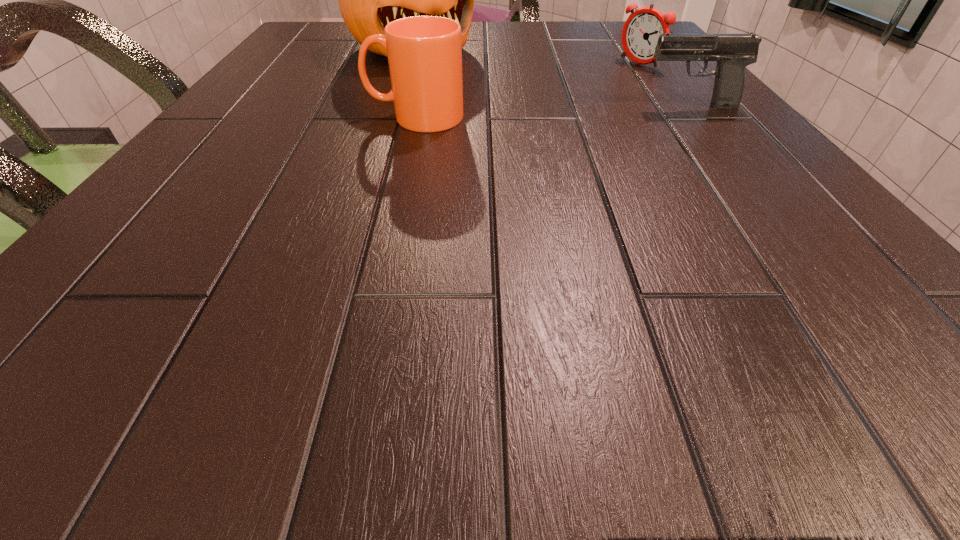
At what (x,y) coordinates should I click in order to perform the action: click on free space located on the face of the pumpkin. Please return your answer as a coordinate pair (x, y). Image resolution: width=960 pixels, height=540 pixels. Looking at the image, I should click on (472, 85).

Identify the location of vacant space situated 0.050m on the face of the pumpkin. The image size is (960, 540). (455, 73).

Locate an element on the screen. free location located 0.380m on the face of the pumpkin is located at coordinates (559, 139).

I want to click on blank space located on the front-facing side of the alarm clock, so click(540, 110).

Locate an element on the screen. vacant space situated 0.310m on the front-facing side of the alarm clock is located at coordinates (528, 115).

At what (x,y) coordinates should I click in order to perform the action: click on free space located 0.100m on the front-facing side of the alarm clock. Please return your answer as a coordinate pair (x, y). Looking at the image, I should click on (599, 82).

This screenshot has width=960, height=540. I want to click on object present at the far edge, so click(x=368, y=0).

The width and height of the screenshot is (960, 540). Identify the location of object at the left edge. (368, 0).

Where is `pistol present at the right edge`? Image resolution: width=960 pixels, height=540 pixels. pistol present at the right edge is located at coordinates (733, 52).

Locate an element on the screen. alarm clock present at the right edge is located at coordinates (640, 34).